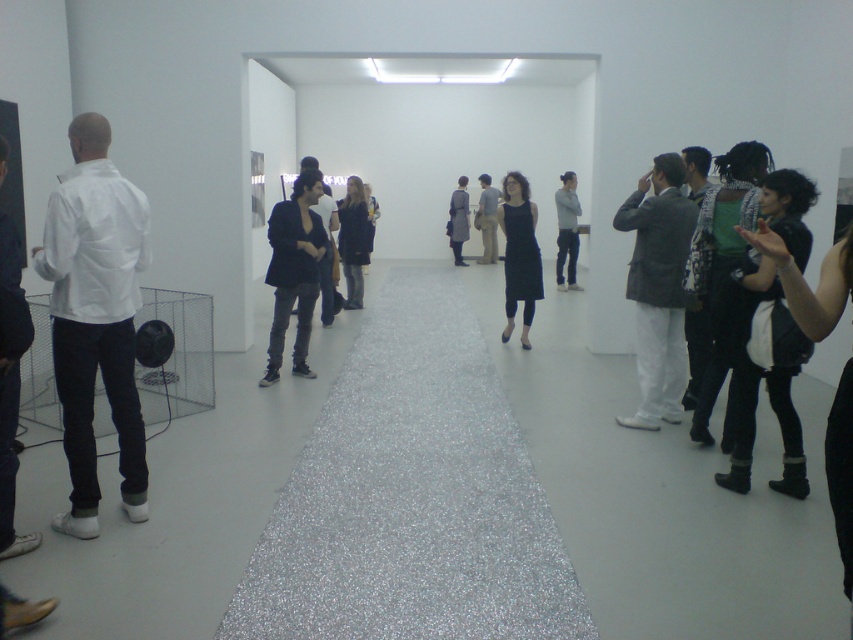
Question: Is black dress at center bigger than dark gray fabric dress at center?

Choices:
 (A) no
 (B) yes

Answer: (A)

Question: Is black matte jacket at center to the right of black dress at center from the viewer's perspective?

Choices:
 (A) yes
 (B) no

Answer: (B)

Question: Which point is closer to the camera?

Choices:
 (A) gray suit at right
 (B) matte white shirt at left
 (C) dark gray fabric dress at center
 (D) black matte jacket at center

Answer: (B)

Question: Is gray suit at right bigger than black matte dress at center?

Choices:
 (A) yes
 (B) no

Answer: (B)

Question: Which point is closer to the camera?

Choices:
 (A) black matte dress at center
 (B) matte white shirt at left
 (C) white matte jacket at left

Answer: (B)

Question: Which point appears farthest from the camera in this image?

Choices:
 (A) (355, 176)
 (B) (67, 221)
 (C) (3, 145)
 (D) (567, 285)

Answer: (A)